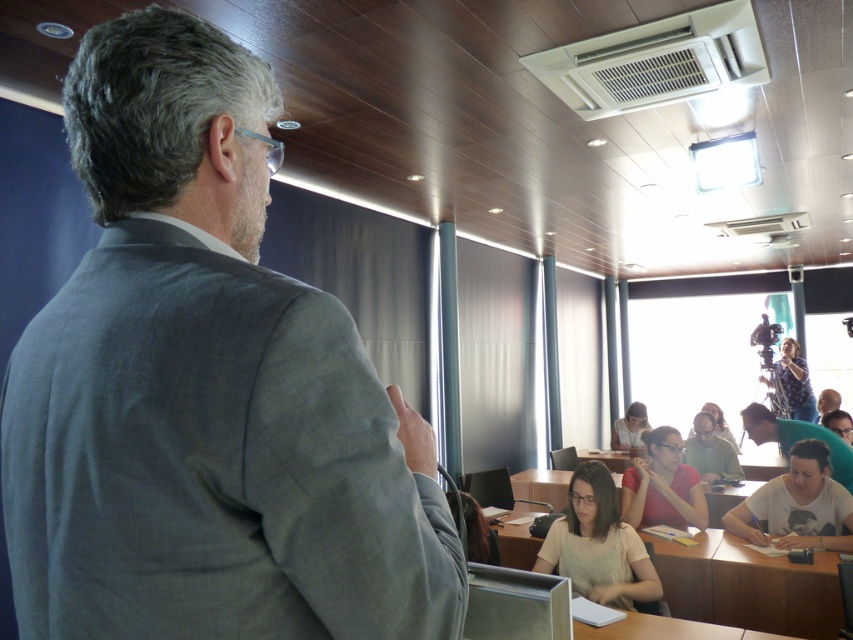
Is light brown hair at lower right to the left of matte gray shirt at center from the viewer's perspective?

In fact, light brown hair at lower right is to the right of matte gray shirt at center.

Is the position of light brown hair at lower right more distant than that of matte gray shirt at center?

No, it is in front of matte gray shirt at center.

What do you see at coordinates (798, 438) in the screenshot? The width and height of the screenshot is (853, 640). I see `light brown hair at lower right` at bounding box center [798, 438].

The width and height of the screenshot is (853, 640). What are the coordinates of `light brown hair at lower right` in the screenshot? It's located at (798, 438).

Measure the distance between white matte shirt at lower right and matte red shirt at center.

They are 18.43 inches apart.

Can you confirm if white matte shirt at lower right is thinner than matte red shirt at center?

No, white matte shirt at lower right is not thinner than matte red shirt at center.

Where is `white matte shirt at lower right`? Image resolution: width=853 pixels, height=640 pixels. white matte shirt at lower right is located at coordinates (798, 506).

Who is more forward, (132, 554) or (782, 422)?

Point (132, 554)

Which is more to the right, gray linen suit at upper left or light brown hair at lower right?

From the viewer's perspective, light brown hair at lower right appears more on the right side.

Does point (431, 484) come closer to viewer compared to point (834, 467)?

Yes, point (431, 484) is in front of point (834, 467).

Where is `gray linen suit at upper left`? gray linen suit at upper left is located at coordinates (212, 460).